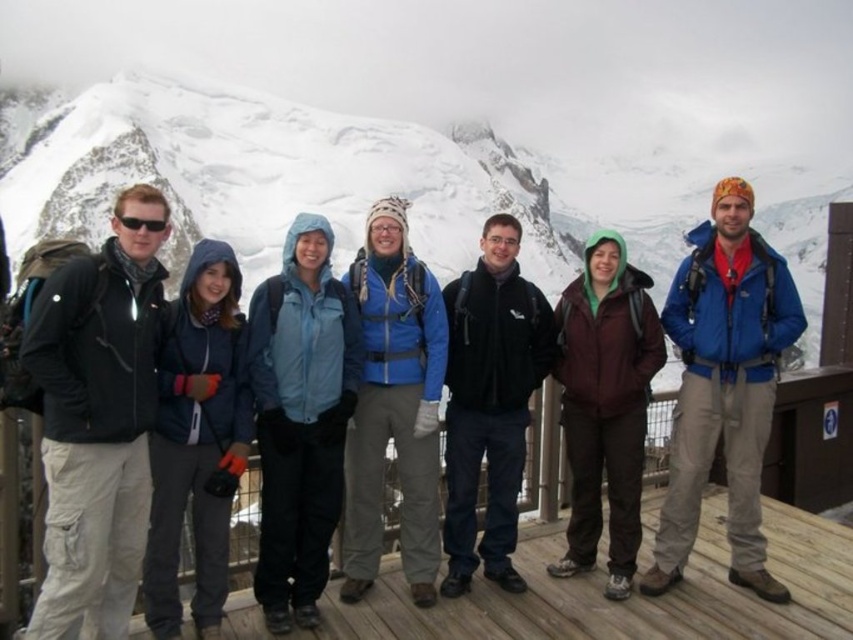
You are a photographer trying to capture a group photo of the seven individuals on the wooden platform. You notice the snowy mountain at upper center and the black fleece jacket at center. Which object is closer to you, the photographer?

The snowy mountain at upper center is closer to you than the black fleece jacket at center because the description states it is further to the viewer, meaning it appears nearer in the scene.

Looking at this image, you are standing on the wooden deck at center and want to take a photo of the black fleece jacket at center. Which direction should you face to ensure the jacket is fully visible in the frame?

Since the wooden deck at center is in front of the black fleece jacket at center, you should face away from the deck towards the jacket to ensure it is fully visible in the frame.